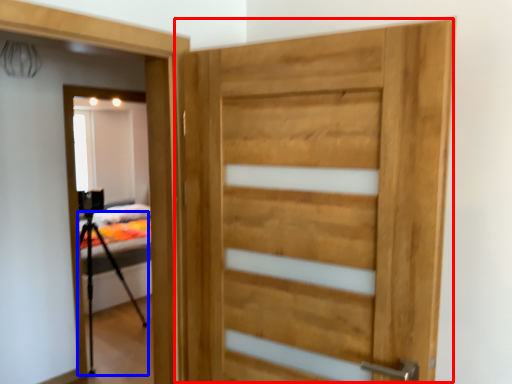
Question: Which object is further to the camera taking this photo, door (highlighted by a red box) or tripod (highlighted by a blue box)?

Choices:
 (A) door
 (B) tripod

Answer: (B)